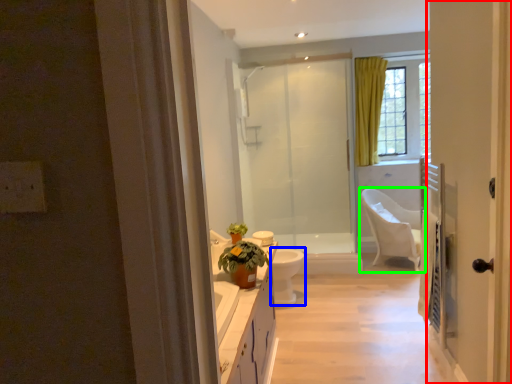
Question: Which is nearer to the door (highlighted by a red box)? toilet bowl (highlighted by a blue box) or chair (highlighted by a green box).

Choices:
 (A) toilet bowl
 (B) chair

Answer: (A)